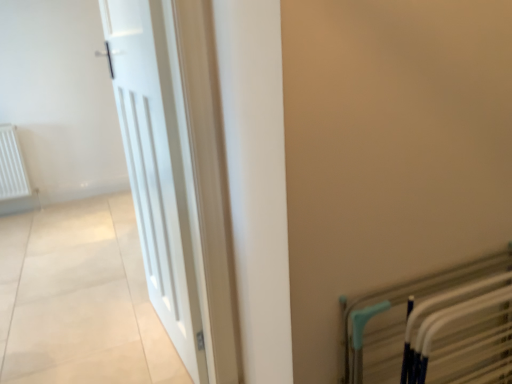
Question: Is there a large distance between metallic silver bed frame at lower right and white wooden door at left?

Choices:
 (A) no
 (B) yes

Answer: (A)

Question: Does metallic silver bed frame at lower right lie behind white wooden door at left?

Choices:
 (A) yes
 (B) no

Answer: (B)

Question: Is metallic silver bed frame at lower right facing away from white wooden door at left?

Choices:
 (A) yes
 (B) no

Answer: (A)

Question: Does metallic silver bed frame at lower right have a smaller size compared to white wooden door at left?

Choices:
 (A) yes
 (B) no

Answer: (A)

Question: Is metallic silver bed frame at lower right in contact with white wooden door at left?

Choices:
 (A) no
 (B) yes

Answer: (A)

Question: Considering the relative sizes of metallic silver bed frame at lower right and white wooden door at left in the image provided, is metallic silver bed frame at lower right taller than white wooden door at left?

Choices:
 (A) no
 (B) yes

Answer: (A)

Question: Is white wooden door at left taller than metallic silver bed frame at lower right?

Choices:
 (A) yes
 (B) no

Answer: (A)

Question: Is white wooden door at left completely or partially outside of metallic silver bed frame at lower right?

Choices:
 (A) yes
 (B) no

Answer: (A)

Question: Is white wooden door at left smaller than metallic silver bed frame at lower right?

Choices:
 (A) yes
 (B) no

Answer: (B)

Question: Does white wooden door at left turn towards metallic silver bed frame at lower right?

Choices:
 (A) no
 (B) yes

Answer: (A)

Question: Can you confirm if white wooden door at left is positioned to the left of metallic silver bed frame at lower right?

Choices:
 (A) yes
 (B) no

Answer: (A)

Question: Can you confirm if white wooden door at left is positioned to the right of metallic silver bed frame at lower right?

Choices:
 (A) no
 (B) yes

Answer: (A)

Question: From their relative heights in the image, would you say metallic silver bed frame at lower right is taller or shorter than white wooden door at left?

Choices:
 (A) tall
 (B) short

Answer: (B)